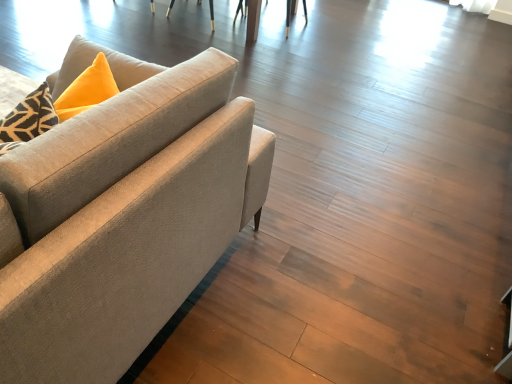
The width and height of the screenshot is (512, 384). Describe the element at coordinates (124, 213) in the screenshot. I see `textured beige couch at left` at that location.

Where is `textured beige couch at left`? textured beige couch at left is located at coordinates (124, 213).

The image size is (512, 384). In order to click on textured beige couch at left in this screenshot , I will do `click(124, 213)`.